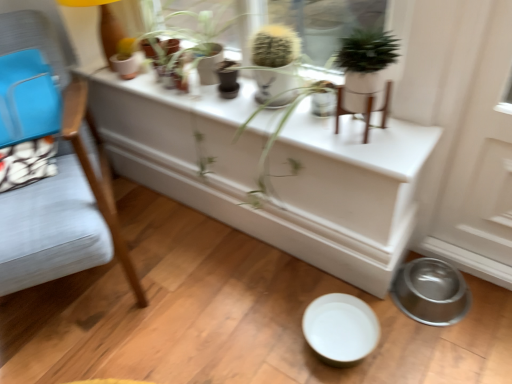
Where is `vacant space in front of white glossy table at center`? The height and width of the screenshot is (384, 512). vacant space in front of white glossy table at center is located at coordinates (225, 301).